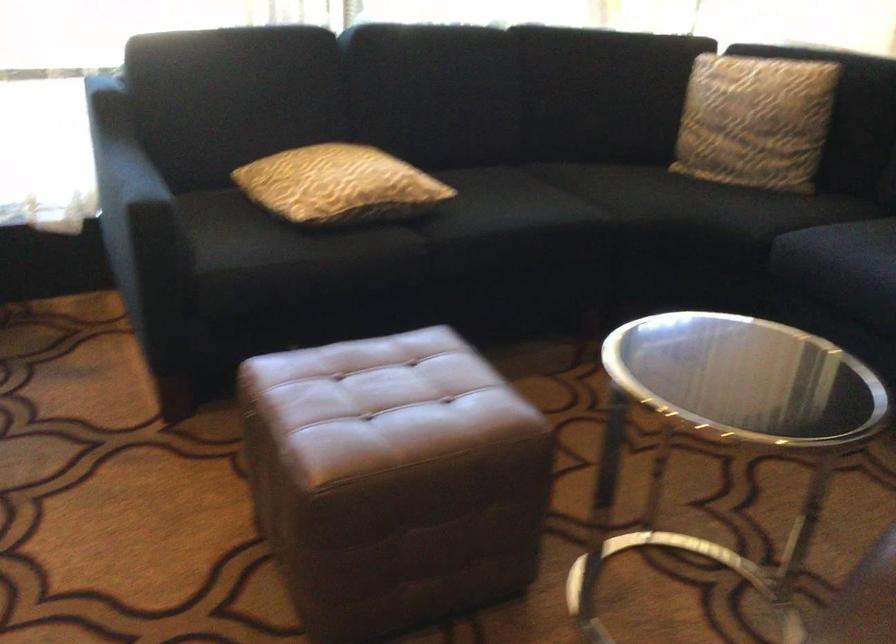
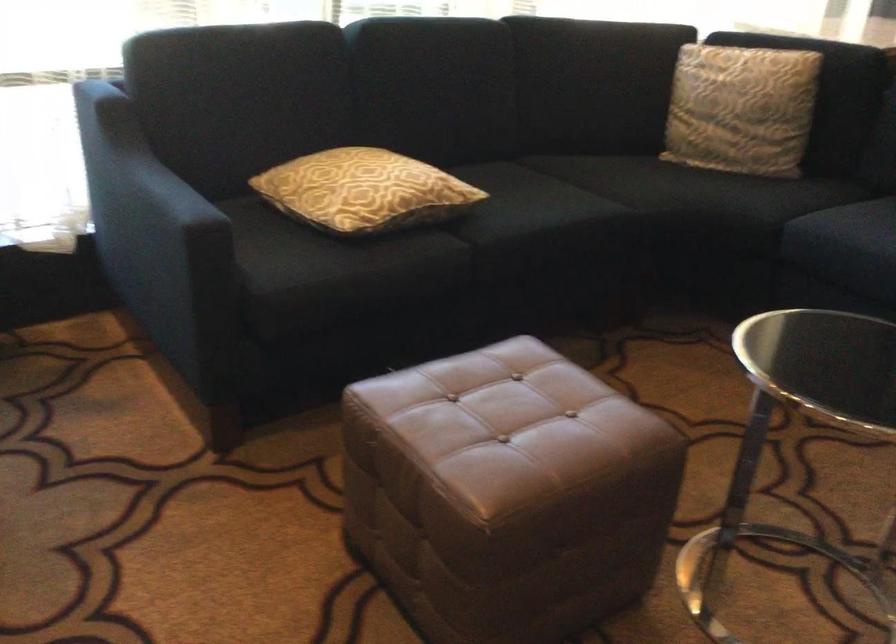
Question: The camera is either moving clockwise (left) or counter-clockwise (right) around the object. The first image is from the beginning of the video and the second image is from the end. Is the camera moving left or right when shooting the video?

Choices:
 (A) Left
 (B) Right

Answer: (A)